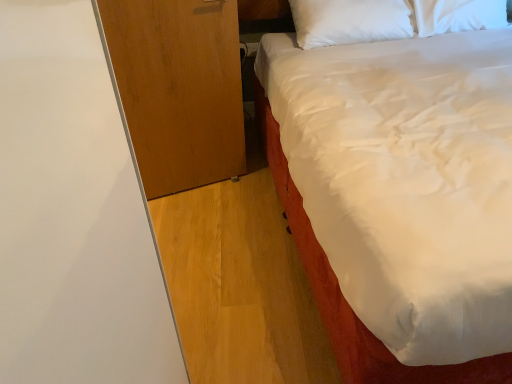
Question: From their relative heights in the image, would you say wooden dresser at left is taller or shorter than white satin bed at upper right?

Choices:
 (A) tall
 (B) short

Answer: (B)

Question: In the image, is wooden dresser at left positioned in front of or behind white satin bed at upper right?

Choices:
 (A) behind
 (B) front

Answer: (A)

Question: Is wooden dresser at left spatially inside white satin bed at upper right, or outside of it?

Choices:
 (A) inside
 (B) outside

Answer: (B)

Question: From their relative heights in the image, would you say white satin bed at upper right is taller or shorter than wooden dresser at left?

Choices:
 (A) short
 (B) tall

Answer: (B)

Question: Based on their sizes in the image, would you say white satin bed at upper right is bigger or smaller than wooden dresser at left?

Choices:
 (A) small
 (B) big

Answer: (B)

Question: Considering the relative positions of white satin bed at upper right and wooden dresser at left in the image provided, is white satin bed at upper right to the left or to the right of wooden dresser at left?

Choices:
 (A) left
 (B) right

Answer: (B)

Question: From the image's perspective, is white satin bed at upper right located above or below wooden dresser at left?

Choices:
 (A) above
 (B) below

Answer: (A)